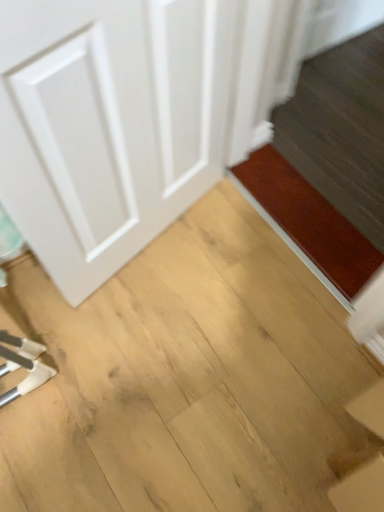
The height and width of the screenshot is (512, 384). I want to click on empty space that is ontop of brown matte doormat at lower right (from a real-world perspective), so click(x=304, y=210).